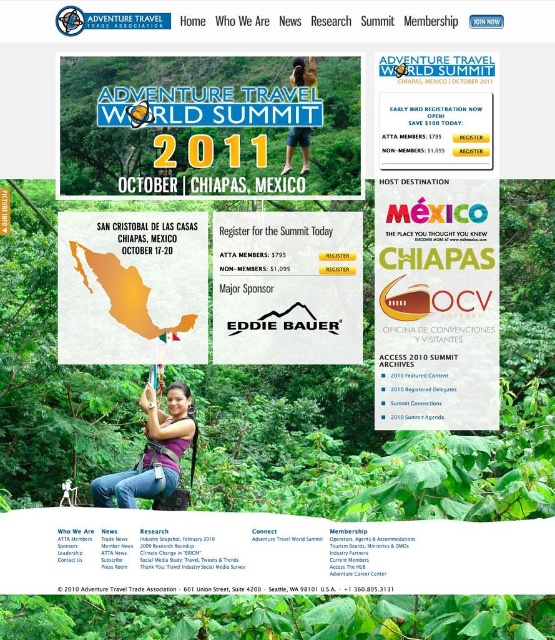
You are designing a layout for a webpage and need to ensure that the matte black logo at center and the matte purple shirt at center are positioned in a way that maintains a comfortable viewing distance for users. Given that the average comfortable viewing distance for such elements is between 3 to 4 feet, does the current placement meet this requirement?

The matte black logo at center is 3.92 feet away from the matte purple shirt at center, which falls within the 3 to 4 feet range. Therefore, the current placement meets the comfortable viewing distance requirement.

You are looking at the webpage for the Adventure Travel World Summit 2011. There are two points marked on the page, one at coordinates point (416, 248) and another at point (319, 356). Which of these points is closer to the top of the page?

Point (319, 356) is closer to the top of the page because its y coordinate is 0.575, which is smaller than 0.750.